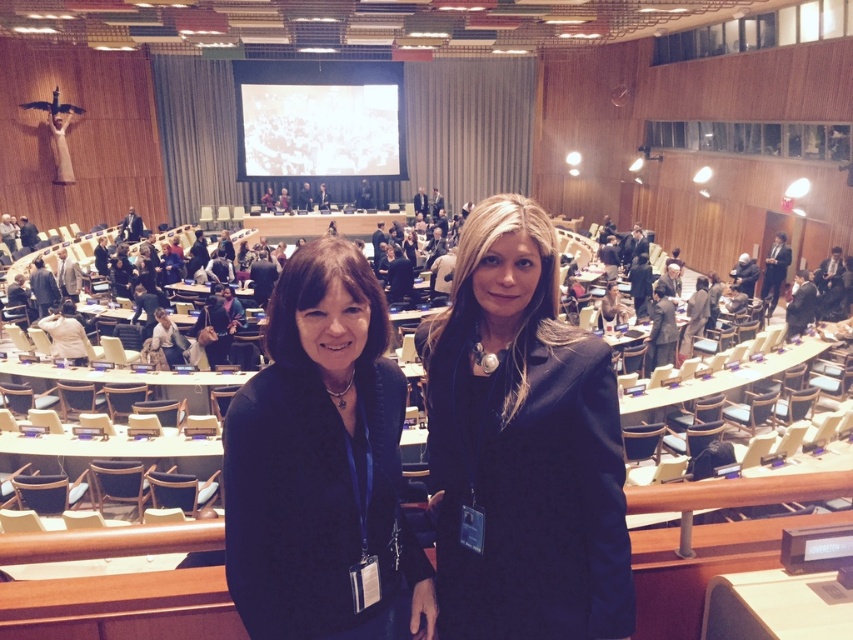
You are standing at the entrance of the conference hall and see both the black wool coat at center and the black matte blazer at center. Which one is closer to you?

The black wool coat at center is closer to you because it is further to the viewer than the black matte blazer at center.

You are organizing a photo shoot and need to fit both the black wool coat at center and the black matte blazer at center into a display case that can only accommodate items up to the size of the larger one. Which item determines the maximum size required for the display case?

The black wool coat at center is larger in size than the black matte blazer at center, so the display case must be sized to accommodate the black wool coat at center.